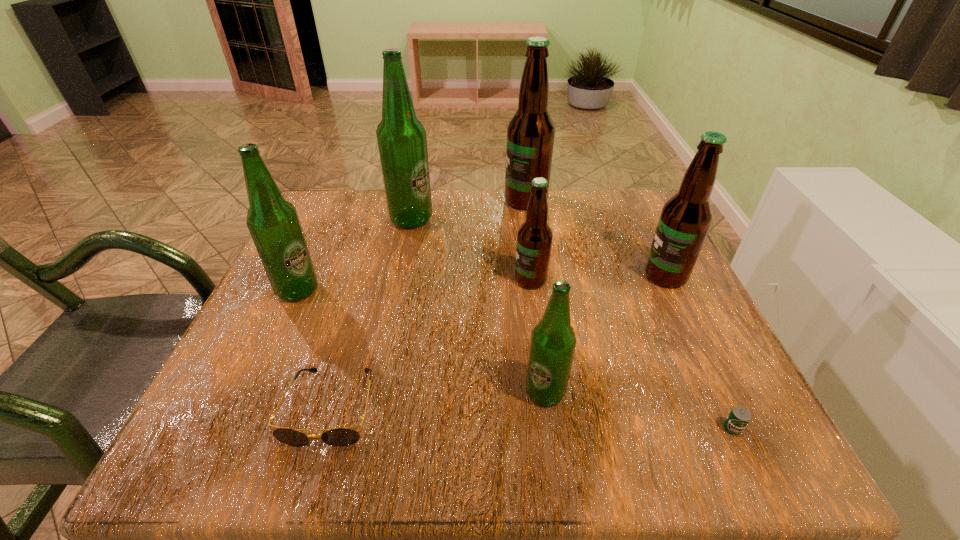
Image resolution: width=960 pixels, height=540 pixels. I want to click on free space located 0.220m on the label of the smallest brown beer bottle, so click(x=406, y=280).

Where is `vacant region located on the label of the smallest brown beer bottle`? This screenshot has width=960, height=540. vacant region located on the label of the smallest brown beer bottle is located at coordinates (322, 280).

The image size is (960, 540). I want to click on vacant position located on the label of the smallest brown beer bottle, so click(x=469, y=280).

Identify the location of vacant space positioned on the label of the nearest green beer bottle. (551, 441).

Identify the location of vacant area situated 0.360m on the left of the beer can. (450, 428).

Identify the location of beer bottle present at the near edge. This screenshot has width=960, height=540. (553, 341).

Find the location of a particular element. This screenshot has width=960, height=540. sunglasses present at the near edge is located at coordinates (342, 436).

Identify the location of beer can that is positioned at the near edge. The width and height of the screenshot is (960, 540). (739, 417).

Identify the location of beer bottle that is at the left edge. (274, 225).

Where is `sunglasses present at the left edge`? This screenshot has height=540, width=960. sunglasses present at the left edge is located at coordinates (342, 436).